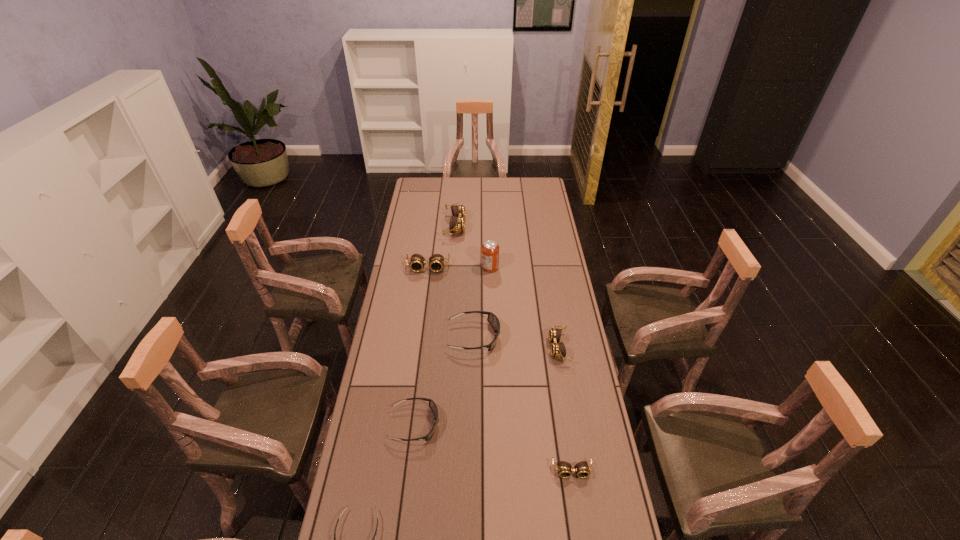
Where is `free area in between the second farthest black goggles and the farthest object`? Image resolution: width=960 pixels, height=540 pixels. free area in between the second farthest black goggles and the farthest object is located at coordinates (435, 325).

You are a GUI agent. You are given a task and a screenshot of the screen. Output one action in this format:
    pyautogui.click(x=<x>, y=<y>)
    Task: Click on the free space between the third biggest brown goggles and the second farthest black goggles
    The height and width of the screenshot is (540, 960).
    Given the screenshot: What is the action you would take?
    pyautogui.click(x=487, y=386)

I want to click on free point between the second farthest black goggles and the rightmost black goggles, so click(444, 381).

You are a GUI agent. You are given a task and a screenshot of the screen. Output one action in this format:
    pyautogui.click(x=<x>, y=<y>)
    Task: Click on the free space between the second smallest black goggles and the smallest brown goggles
    The height and width of the screenshot is (540, 960).
    Given the screenshot: What is the action you would take?
    493,447

Select which object appears as the third closest to the second biggest brown goggles. Please provide its 2D coordinates. Your answer should be formatted as a tuple, i.e. [(x, y)], where the tuple contains the x and y coordinates of a point satisfying the conditions above.

[(492, 318)]

Point out which object is positioned as the sixth nearest to the third nearest object. Please provide its 2D coordinates. Your answer should be formatted as a tuple, i.e. [(x, y)], where the tuple contains the x and y coordinates of a point satisfying the conditions above.

[(490, 249)]

Select which goggles is the fifth closest to the biggest black goggles. Please provide its 2D coordinates. Your answer should be formatted as a tuple, i.e. [(x, y)], where the tuple contains the x and y coordinates of a point satisfying the conditions above.

[(457, 222)]

Image resolution: width=960 pixels, height=540 pixels. I want to click on goggles that is the fourth closest one to the rightmost black goggles, so click(564, 470).

Image resolution: width=960 pixels, height=540 pixels. I want to click on the third closest brown goggles to the farthest black goggles, so click(x=564, y=470).

Locate an element on the screen. This screenshot has height=540, width=960. the fourth closest brown goggles to the farthest black goggles is located at coordinates (457, 222).